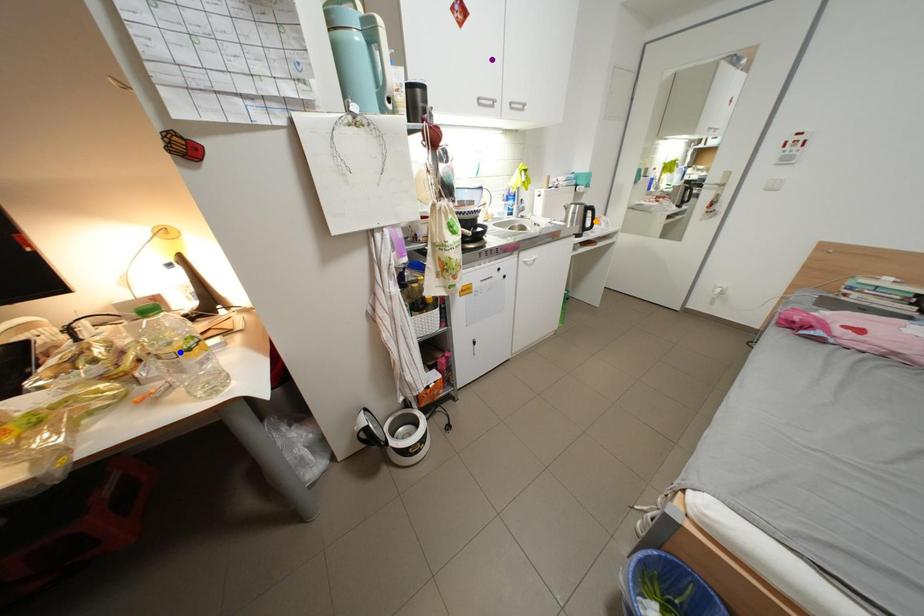
Order these from farthest to nearest:
- orange point
- purple point
- blue point

1. orange point
2. purple point
3. blue point